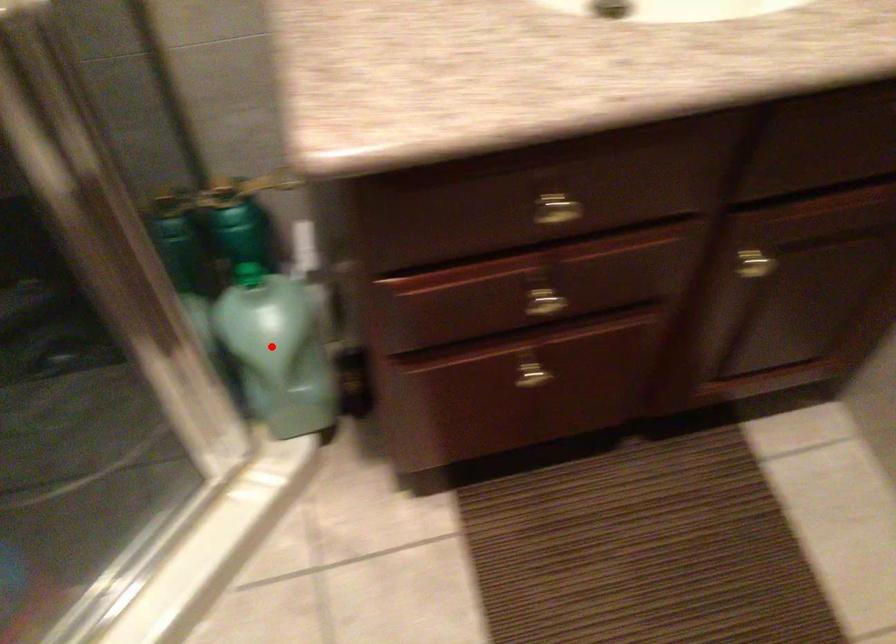
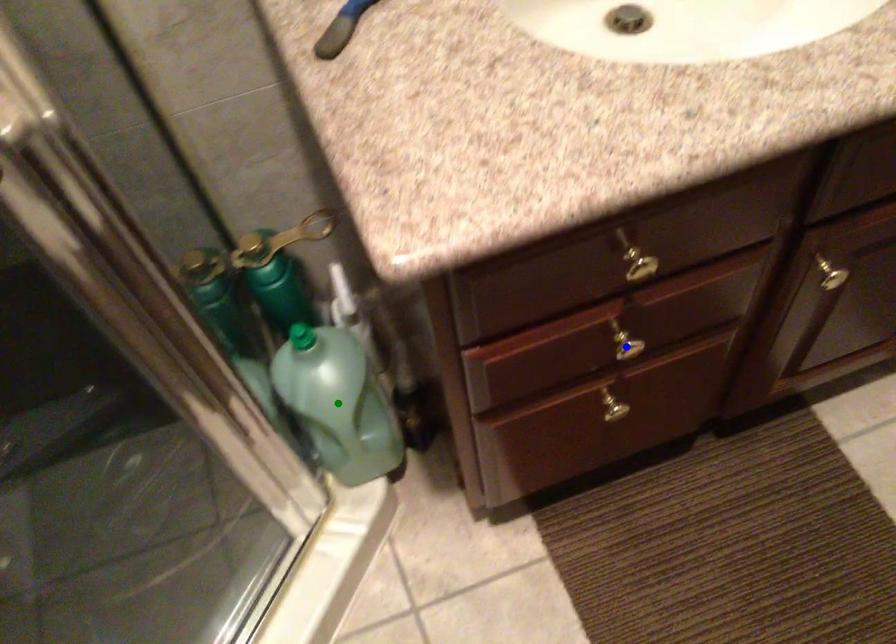
Question: I am providing you with two images of the same scene from different viewpoints. A red point is marked on the first image. You are given multiple points on the second image. In image 2, which mark is for the same physical point as the one in image 1?

Choices:
 (A) yellow point
 (B) blue point
 (C) green point

Answer: (A)